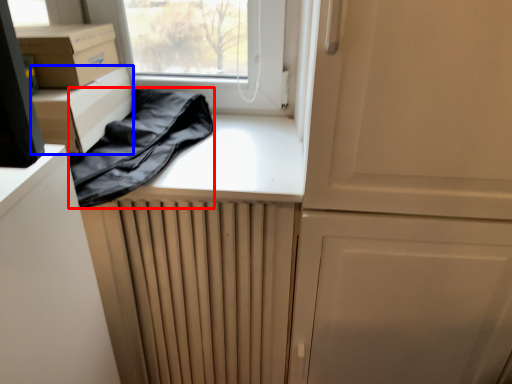
Question: Among these objects, which one is nearest to the camera, clothing (highlighted by a red box) or cardboard box (highlighted by a blue box)?

Choices:
 (A) clothing
 (B) cardboard box

Answer: (A)